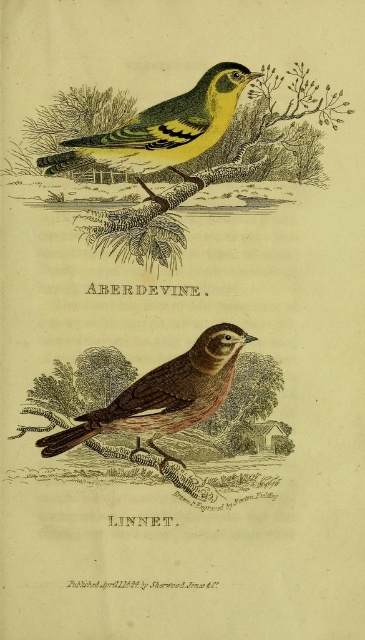
In the vintage illustration, there are two birds labeled ABERDEVINE and LINNET. The ABERDEVINE is perched on a green textured branch at upper center marked by point (229,164). If you were to draw a straight line from the LINNET to this point, would it pass through the ABERDEVINE?

The point (229,164) marks the green textured branch at upper center where the ABERDEVINE is perched. Since the LINNET is another bird in the image, drawing a straight line from the LINNET to this point would pass through the ABERDEVINE if they are aligned along that line. However, without specific positional data for the LINNET, we cannot confirm this definitively. The question cannot be answered with the provided information.